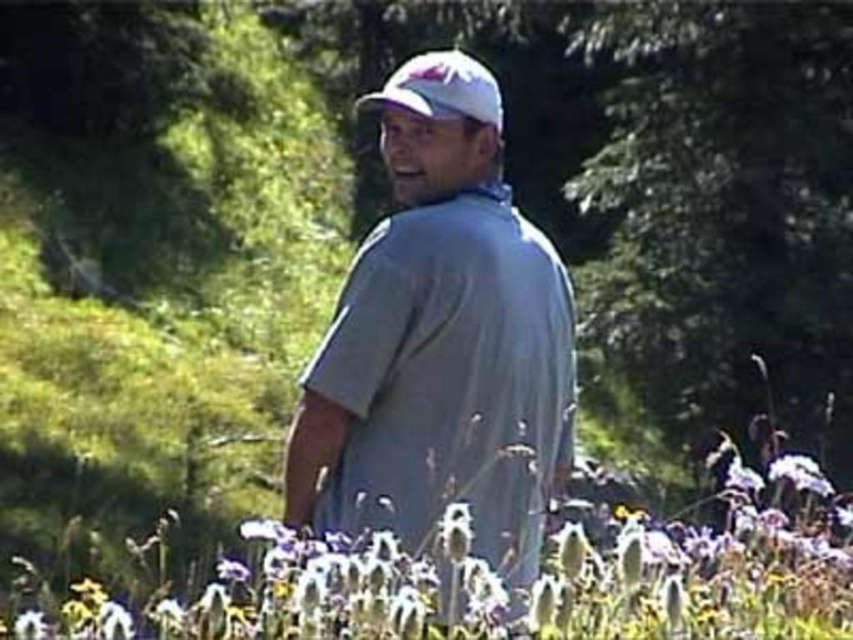
Question: Can you confirm if white fluffy flower at center is thinner than white matte hat at center?

Choices:
 (A) no
 (B) yes

Answer: (A)

Question: Can you confirm if white fluffy flower at center is positioned below white matte hat at center?

Choices:
 (A) yes
 (B) no

Answer: (A)

Question: Is white fluffy flower at center below white matte hat at center?

Choices:
 (A) yes
 (B) no

Answer: (A)

Question: Which point appears closest to the camera in this image?

Choices:
 (A) coord(457,109)
 (B) coord(486,595)
 (C) coord(422,88)

Answer: (B)

Question: Which object appears closest to the camera in this image?

Choices:
 (A) white matte hat at center
 (B) gray cotton shirt at center
 (C) white fluffy flower at center

Answer: (C)

Question: Estimate the real-world distances between objects in this image. Which object is closer to the white matte hat at center?

Choices:
 (A) gray cotton shirt at center
 (B) white fluffy flower at center

Answer: (A)